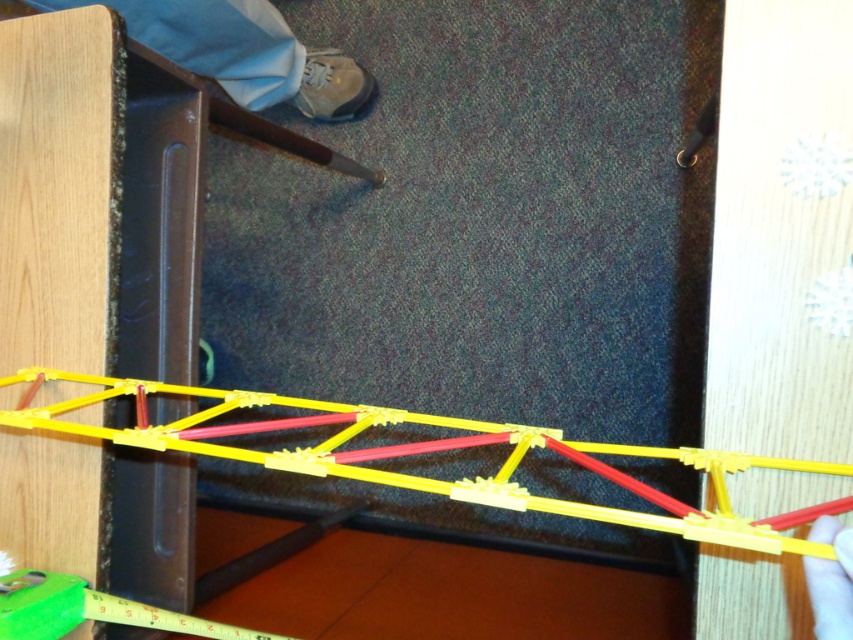
You are a construction worker inspecting a model structure. You notice the yellow plastic bridge at center and the light blue fabric pants at lower left. Which object is bigger in size?

The yellow plastic bridge at center is larger in size compared to the light blue fabric pants at lower left.

You are trying to reach the smooth plastic hand at lower right to pick it up, but the yellow plastic bridge at center is blocking your path. Can you move around the bridge to get to the hand?

The smooth plastic hand at lower right is behind the yellow plastic bridge at center, so you can move around the bridge to access the hand.

You are a construction worker trying to build a model. You see the light blue fabric pants at lower left and the smooth plastic hand at lower right. Which object takes up more space in the image?

The light blue fabric pants at lower left is larger in size than the smooth plastic hand at lower right, so it takes up more space in the image.